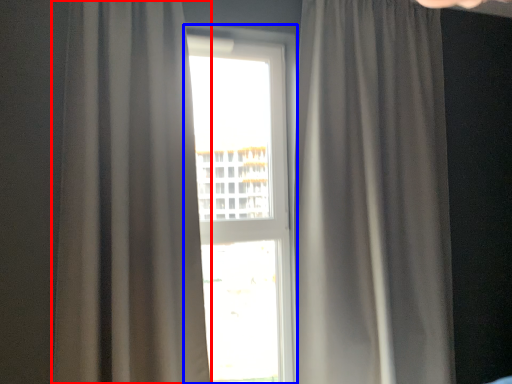
Question: Which of the following is the closest to the observer, curtain (highlighted by a red box) or window (highlighted by a blue box)?

Choices:
 (A) curtain
 (B) window

Answer: (A)